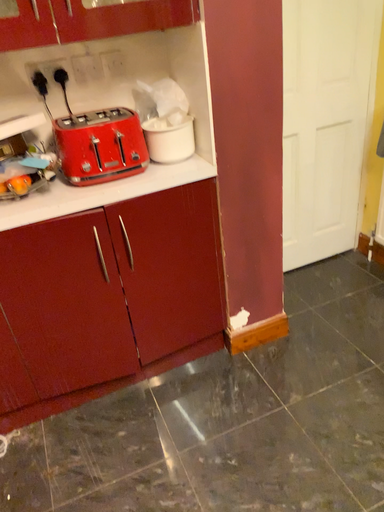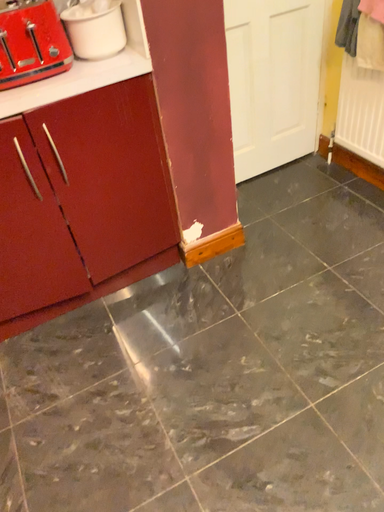
Question: Which way did the camera rotate in the video?

Choices:
 (A) rotated upward
 (B) rotated downward

Answer: (B)